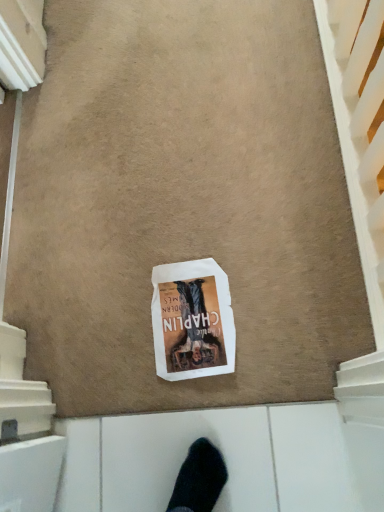
Describe the element at coordinates (192, 320) in the screenshot. I see `white paper bag at center` at that location.

The width and height of the screenshot is (384, 512). I want to click on white paper bag at center, so click(192, 320).

What is the approximate width of white paper bag at center?

It is 12.06 inches.

Measure the distance between white paper bag at center and camera.

A distance of 1.03 meters exists between white paper bag at center and camera.

I want to click on white paper bag at center, so click(x=192, y=320).